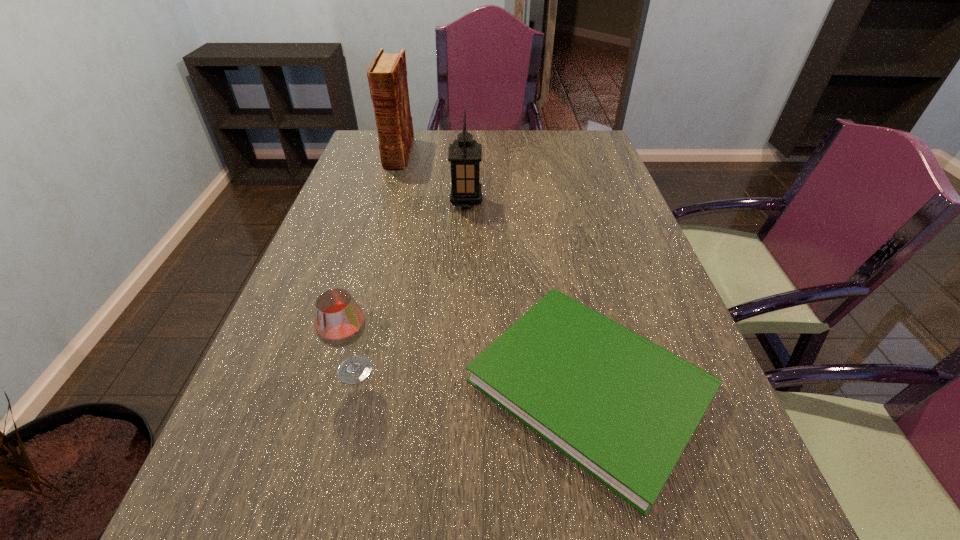
Identify the location of vacant area in the image that satisfies the following two spatial constraints: 1. on the spine side of the second shortest object; 2. on the right side of the hardback book. The image size is (960, 540). (334, 370).

I want to click on vacant point that satisfies the following two spatial constraints: 1. on the spine side of the third tallest object; 2. on the right side of the hardback book, so click(x=334, y=370).

Locate an element on the screen. This screenshot has width=960, height=540. free space that satisfies the following two spatial constraints: 1. on the front side of the second farthest object; 2. on the right side of the paperback book is located at coordinates (459, 386).